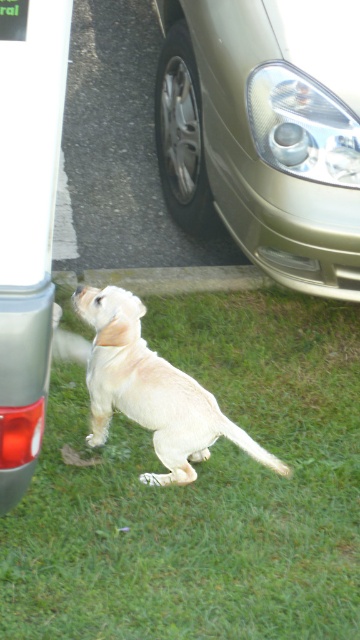
Does green grass at lower center appear under gold metallic car at upper center?

Yes, green grass at lower center is below gold metallic car at upper center.

Who is taller, green grass at lower center or gold metallic car at upper center?

gold metallic car at upper center is taller.

This screenshot has width=360, height=640. Find the location of `green grass at lower center`. green grass at lower center is located at coordinates (203, 492).

At what (x,y) coordinates should I click in order to perform the action: click on green grass at lower center. Please return your answer as a coordinate pair (x, y). Looking at the image, I should click on (203, 492).

In the scene shown: Measure the distance from gold metallic car at upper center to metallic gold car at center.

A distance of 2.12 meters exists between gold metallic car at upper center and metallic gold car at center.

From the picture: Between gold metallic car at upper center and metallic gold car at center, which one is positioned lower?

metallic gold car at center is lower down.

Locate an element on the screen. This screenshot has width=360, height=640. gold metallic car at upper center is located at coordinates pyautogui.click(x=264, y=132).

Is the position of metallic gold car at center less distant than that of light beige fur dog at center?

Yes, metallic gold car at center is in front of light beige fur dog at center.

Between point (15, 204) and point (244, 429), which one is positioned behind?

The point (244, 429) is more distant.

I want to click on metallic gold car at center, so click(x=28, y=221).